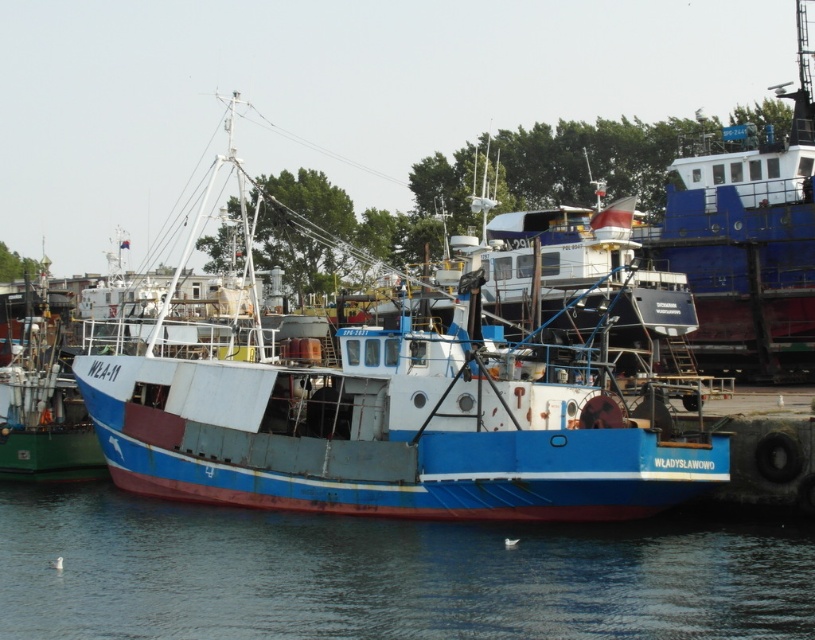
Question: Which of the following is the closest to the observer?

Choices:
 (A) (40, 486)
 (B) (399, 310)

Answer: (A)

Question: Is blue painted metal boat at center above blue water at lower center?

Choices:
 (A) yes
 (B) no

Answer: (A)

Question: Which object is farther from the camera taking this photo?

Choices:
 (A) blue water at lower center
 (B) blue painted metal boat at center

Answer: (B)

Question: Which object is farther from the camera taking this photo?

Choices:
 (A) blue water at lower center
 (B) blue painted metal boat at center

Answer: (B)

Question: Does blue painted metal boat at center appear on the right side of blue water at lower center?

Choices:
 (A) yes
 (B) no

Answer: (B)

Question: Is blue painted metal boat at center wider than blue water at lower center?

Choices:
 (A) yes
 (B) no

Answer: (A)